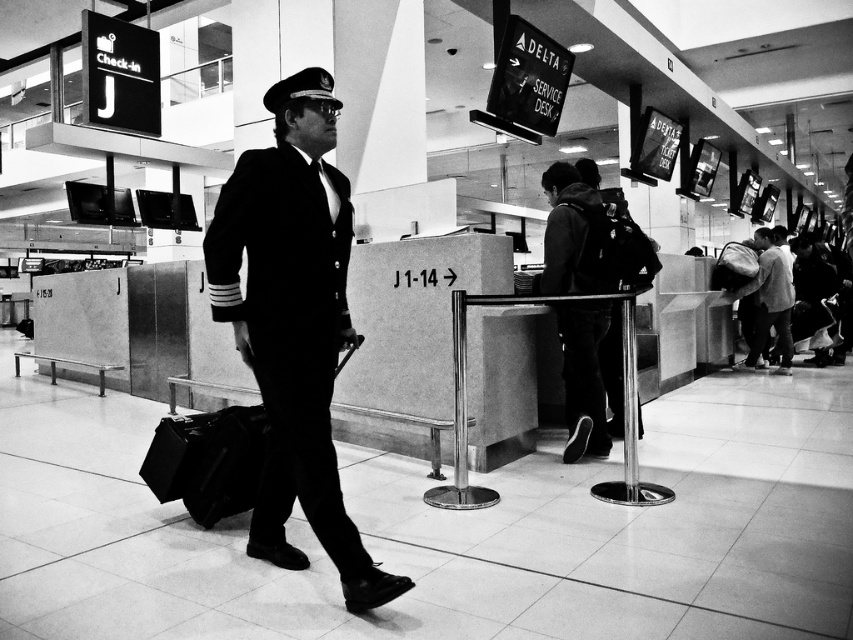
Consider the image. You are a traveler who just arrived at the airport. You see a matte black suitcase at center and a light gray fabric backpack at center. Which one is thinner?

The matte black suitcase at center is thinner than the light gray fabric backpack at center.

You are a photographer standing in the airport terminal. You need to capture a photo where both the velvet black uniform at center and the matte black suitcase at center are clearly visible. Based on their sizes, which object should you focus on first to ensure it doesn

The velvet black uniform at center is much taller than the matte black suitcase at center. Therefore, you should focus on the velvet black uniform at center first since it is larger and more prominent in the frame, ensuring it is in sharp focus before adjusting for the smaller suitcase.

You are a traveler at the airport and you see both the matte black suitcase at center and the light gray fabric backpack at center. Which one is the smaller one?

The matte black suitcase at center is smaller than the light gray fabric backpack at center.